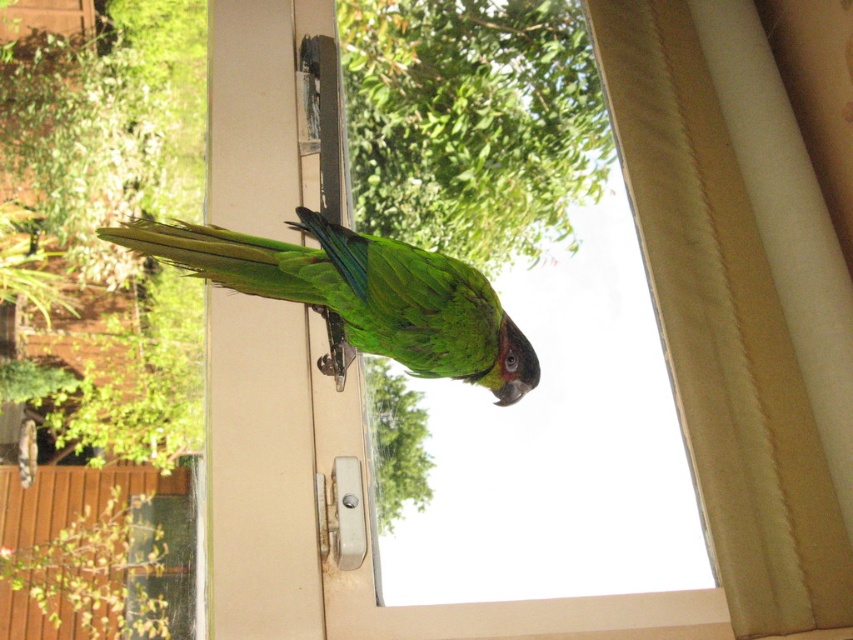
Based on the photo, you are standing 5 feet away from the window frame where the parrot is perched. You notice a specific point marked at coordinates point (x=566, y=97). Can you reach that point with your hand without moving closer than your current position?

The distance of point (x=566, y=97) from viewer is 4.90 feet, so yes, you can reach it with your hand since you are already at 5 feet away, which is slightly farther than the point.

You are a delivery person trying to see the apartment number through the transparent glass window at center. The green matte parrot at center is blocking your view. Can you look over the parrot to see the number above the window?

The transparent glass window at center is much taller than the green matte parrot at center, so yes, you can look over the parrot to see the number above the window.

You are a visitor in a house and want to look outside through the transparent glass window at center. However, the beige textured curtain at upper right might be blocking your view. Is the window to the left or right of the curtain?

The transparent glass window at center is to the left of beige textured curtain at upper right, so the window is positioned to the left side of the curtain, meaning the curtain is on the right side relative to the window. Therefore, the curtain is not blocking the window since it is placed to the right of it.